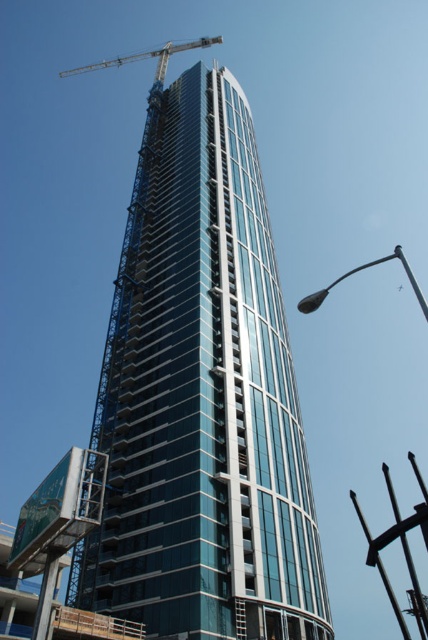
You are standing in front of the construction site and want to determine the relative positions of two points marked in the image. Which of the two points, point (x=139, y=198) or point (x=155, y=49), is closer to your current position?

Point (x=139, y=198) is closer to the camera than point (x=155, y=49), so it is closer to your current position.

You are a construction worker standing on the ground floor of the glassy steel tower at center. You need to move a heavy beam to the area near the metallic silver crane at top left. Considering their positions, which direction should you move the beam to reach the crane?

The glassy steel tower at center is in front of the metallic silver crane at top left, so you should move the beam towards the back of the tower to reach the crane.

What are the coordinates of the glassy steel tower at center?

The glassy steel tower at center is located at coordinates point [202,396].